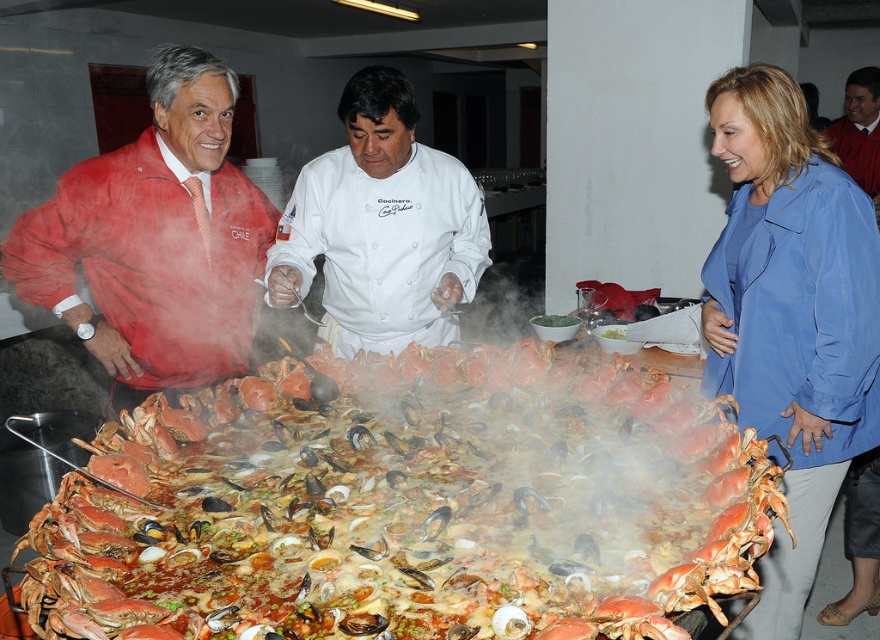
Between shiny orange crab at center and smooth skin face at upper right, which one is positioned lower?

shiny orange crab at center

Does point (132, 582) come in front of point (866, 168)?

Yes.

Between point (534, 509) and point (856, 152), which one is positioned in front?

Point (534, 509) is in front.

Where is `shiny orange crab at center`? Image resolution: width=880 pixels, height=640 pixels. shiny orange crab at center is located at coordinates (409, 506).

This screenshot has width=880, height=640. What do you see at coordinates (155, 241) in the screenshot?
I see `matte red jacket at left` at bounding box center [155, 241].

Is point (145, 244) closer to camera compared to point (468, 241)?

Yes, it is in front of point (468, 241).

Locate an element on the screen. The width and height of the screenshot is (880, 640). matte red jacket at left is located at coordinates (155, 241).

Is shiny orange crab at center positioned behind white chef coat at center?

No, it is not.

What do you see at coordinates (409, 506) in the screenshot?
I see `shiny orange crab at center` at bounding box center [409, 506].

Who is more distant from viewer, (x=572, y=397) or (x=392, y=339)?

Positioned behind is point (x=392, y=339).

This screenshot has width=880, height=640. I want to click on shiny orange crab at center, so click(x=409, y=506).